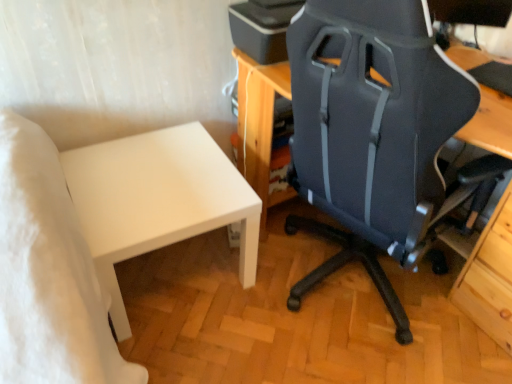
Question: From their relative heights in the image, would you say white matte table at lower left is taller or shorter than matte black printer at upper center?

Choices:
 (A) short
 (B) tall

Answer: (B)

Question: From a real-world perspective, relative to matte black printer at upper center, is white matte table at lower left vertically above or below?

Choices:
 (A) above
 (B) below

Answer: (B)

Question: Estimate the real-world distances between objects in this image. Which object is closer to the matte black chair at center?

Choices:
 (A) matte black printer at upper center
 (B) white matte table at lower left

Answer: (A)

Question: Based on their relative distances, which object is nearer to the matte black printer at upper center?

Choices:
 (A) white matte table at lower left
 (B) matte black chair at center

Answer: (B)